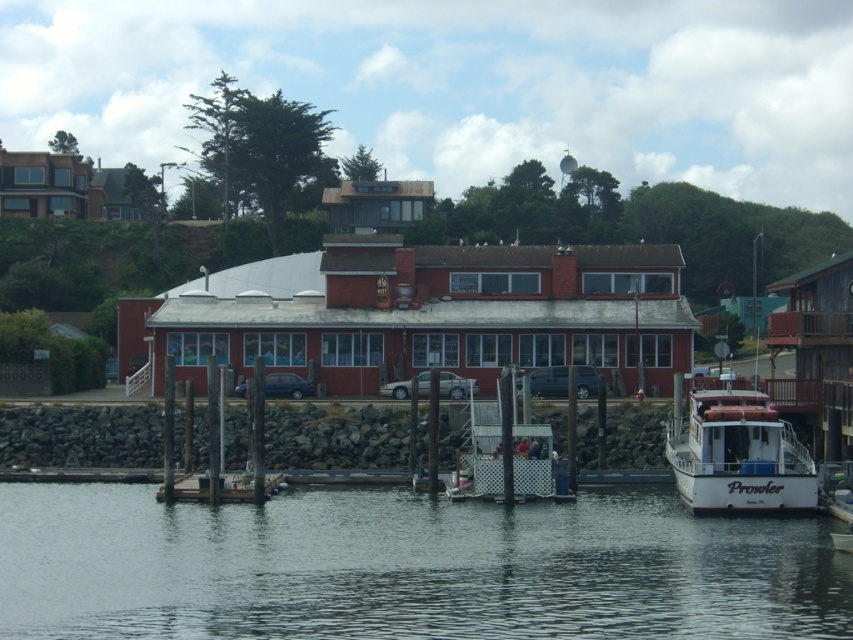
Question: Which object is closer to the camera taking this photo?

Choices:
 (A) white matte boat at lower right
 (B) transparent water at lower center

Answer: (B)

Question: Which point is closer to the camera taking this photo?

Choices:
 (A) (723, 506)
 (B) (207, 586)

Answer: (B)

Question: Is transparent water at lower center to the right of white matte boat at lower right from the viewer's perspective?

Choices:
 (A) yes
 (B) no

Answer: (B)

Question: Can you confirm if transparent water at lower center is thinner than white matte boat at lower right?

Choices:
 (A) no
 (B) yes

Answer: (A)

Question: Is transparent water at lower center above white matte boat at lower right?

Choices:
 (A) no
 (B) yes

Answer: (A)